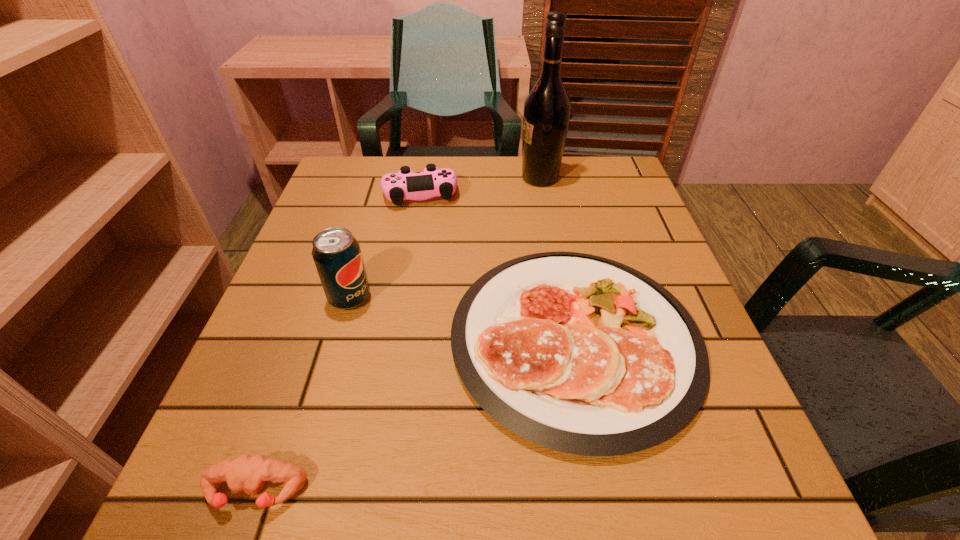
You are a GUI agent. You are given a task and a screenshot of the screen. Output one action in this format:
    pyautogui.click(x=<x>, y=<y>)
    Task: Click on the wine bottle
    
    Given the screenshot: What is the action you would take?
    pyautogui.click(x=547, y=108)

Where is `the second tallest object`? This screenshot has width=960, height=540. the second tallest object is located at coordinates click(x=336, y=252).

Locate an element on the screen. Image resolution: width=960 pixels, height=540 pixels. the third tallest object is located at coordinates (405, 185).

You are a GUI agent. You are given a task and a screenshot of the screen. Output one action in this format:
    pyautogui.click(x=<x>, y=<y>)
    Task: Click on the dish
    
    Given the screenshot: What is the action you would take?
    pyautogui.click(x=578, y=353)

I want to click on the nearest object, so click(247, 473).

At what (x,y) coordinates should I click in order to perform the action: click on free space located 0.090m on the label of the tallest object. Please return your answer as a coordinate pair (x, y). The image size is (960, 540). Looking at the image, I should click on (484, 178).

Find the location of a particular element. This screenshot has width=960, height=540. vacant point located on the label of the tallest object is located at coordinates (437, 178).

This screenshot has height=540, width=960. Identify the location of vacant space positioned on the label of the tallest object. (405, 178).

Find the location of a particular element. The image size is (960, 540). free space located 0.110m on the right of the fourth shortest object is located at coordinates (429, 298).

Find the location of `free space located 0.060m on the front of the control`. free space located 0.060m on the front of the control is located at coordinates (414, 227).